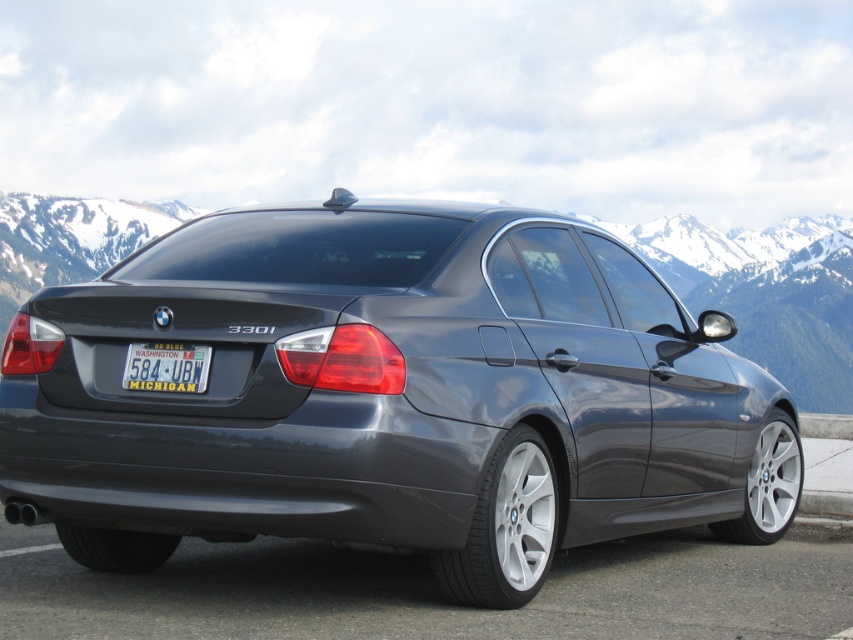
Question: Which object is farther from the camera taking this photo?

Choices:
 (A) yellowtexturedlicense plate at lower center
 (B) satin metallic sedan at center

Answer: (A)

Question: In this image, where is satin metallic sedan at center located relative to yellowtexturedlicense plate at lower center?

Choices:
 (A) left
 (B) right

Answer: (B)

Question: Is satin metallic sedan at center positioned behind yellowtexturedlicense plate at lower center?

Choices:
 (A) yes
 (B) no

Answer: (B)

Question: Where is satin metallic sedan at center located in relation to yellowtexturedlicense plate at lower center in the image?

Choices:
 (A) below
 (B) above

Answer: (A)

Question: Which point is closer to the camera?

Choices:
 (A) (138, 355)
 (B) (364, 216)

Answer: (A)